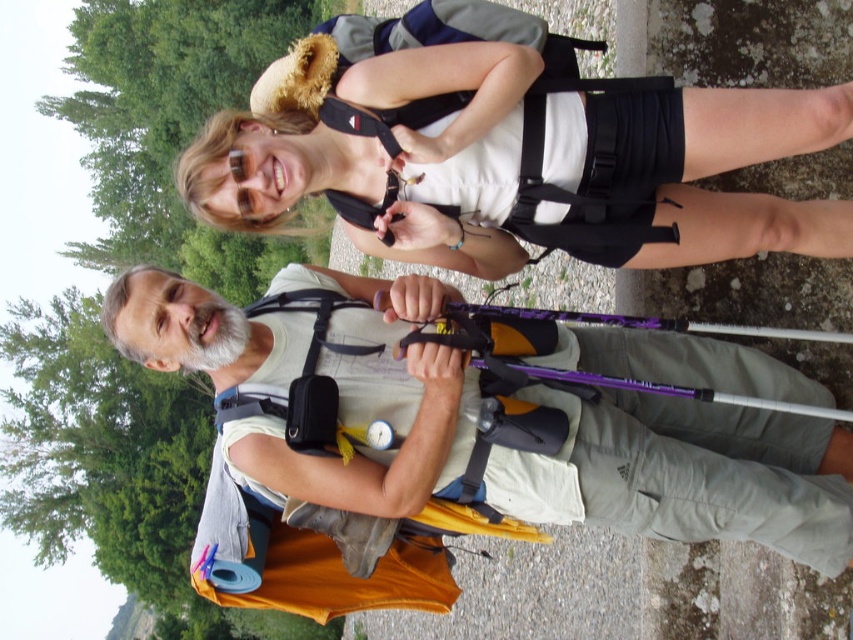
You are a hiker planning to carry both the matte black backpack at upper center and the purple glossy ski pole at center. Considering their sizes, which item would require more horizontal space in your storage compartment?

The matte black backpack at upper center might be wider than the purple glossy ski pole at center, so it would require more horizontal space in the storage compartment.

You are a hiker planning to take a photo of the landscape in front of you. There is a point at coordinates point (x=795, y=516) that you want to focus on. If your camera can only focus on objects within 10 meters, will you be able to capture the point clearly?

The distance of point (x=795, y=516) from the camera is 11.48 meters, which is beyond the camera focus range of 10 meters. Therefore, you won not be able to capture the point clearly.

You are a hiker who wants to pass a narrow path between two trees. The path is 3 feet wide. You are carrying the matte black backpack at upper center. Can you safely pass through the path while keeping the backpack on your back?

The distance between the two hikers is 36.32 feet, but this information does not relate to the width of the path or the backpack. Therefore, it is unclear if the matte black backpack at upper center can fit through the 3 feet wide path. More information about the backpack dimensions or the path width is needed to determine safety.